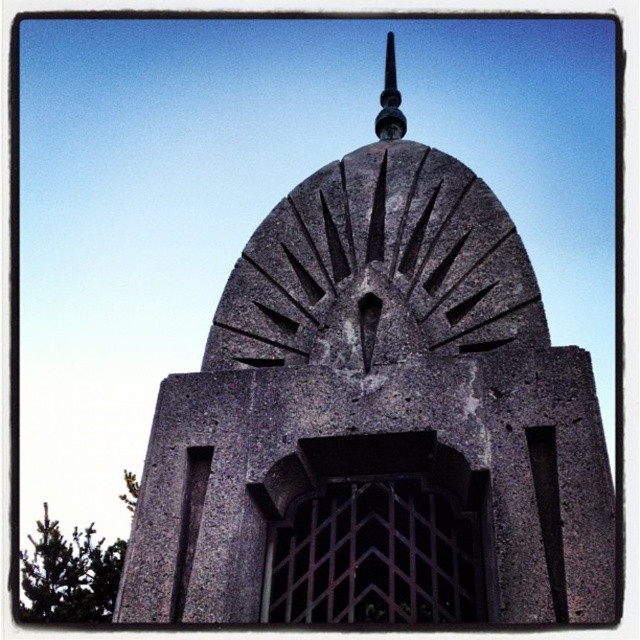
Is point (250, 589) in front of point (381, 132)?

Yes, point (250, 589) is closer to viewer.

You are a GUI agent. You are given a task and a screenshot of the screen. Output one action in this format:
    pyautogui.click(x=<x>, y=<y>)
    Task: Click on the gray stone tower at center
    This screenshot has width=640, height=640.
    Given the screenshot: What is the action you would take?
    pyautogui.click(x=378, y=422)

Find the location of `gray stone tower at center`. gray stone tower at center is located at coordinates (378, 422).